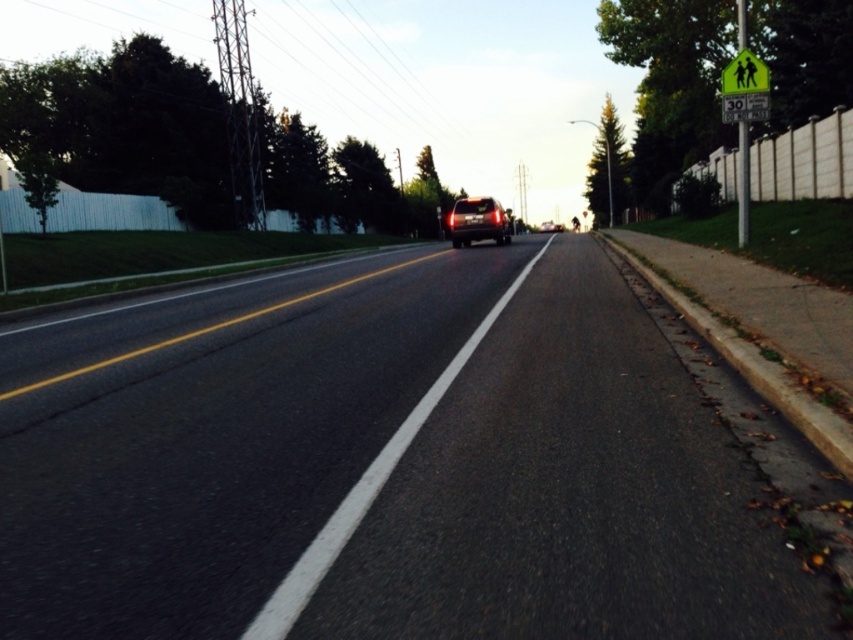
Can you confirm if black asphalt road at center is positioned to the right of green reflective pedestrian crossing sign at upper right?

In fact, black asphalt road at center is to the left of green reflective pedestrian crossing sign at upper right.

Can you confirm if black asphalt road at center is bigger than green reflective pedestrian crossing sign at upper right?

Indeed, black asphalt road at center has a larger size compared to green reflective pedestrian crossing sign at upper right.

Is point (161, 531) behind point (762, 92)?

No, it is in front of (762, 92).

This screenshot has width=853, height=640. Identify the location of black asphalt road at center. (381, 465).

Image resolution: width=853 pixels, height=640 pixels. I want to click on satin black suv at center, so click(479, 221).

Find the location of a particular element. satin black suv at center is located at coordinates [x=479, y=221].

Does black asphalt road at center come in front of satin black suv at center?

Yes, it is in front of satin black suv at center.

Can you confirm if black asphalt road at center is positioned above satin black suv at center?

Actually, black asphalt road at center is below satin black suv at center.

You are a GUI agent. You are given a task and a screenshot of the screen. Output one action in this format:
    pyautogui.click(x=<x>, y=<y>)
    Task: Click on the black asphalt road at center
    This screenshot has height=640, width=853.
    Given the screenshot: What is the action you would take?
    pyautogui.click(x=381, y=465)